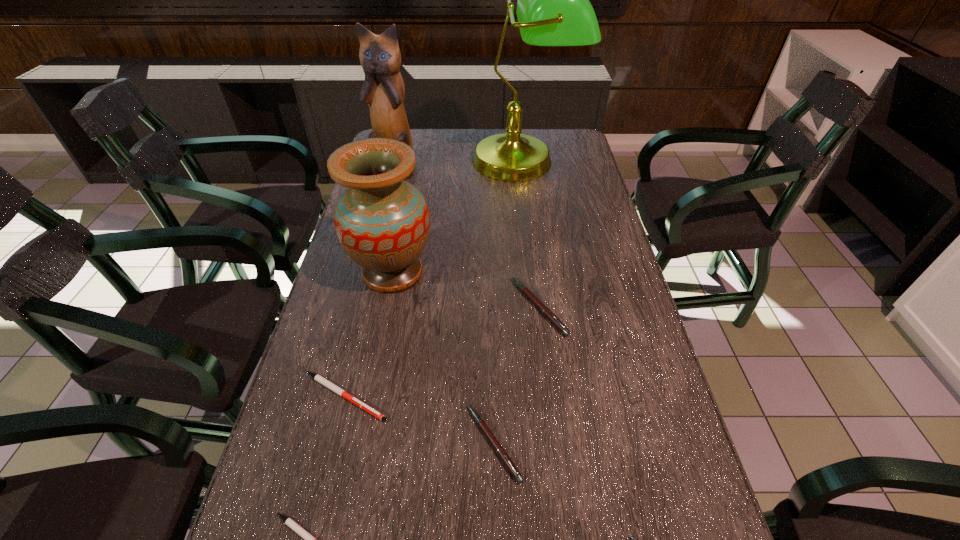
The height and width of the screenshot is (540, 960). I want to click on lamp, so click(553, 9).

The image size is (960, 540). In order to click on the tallest object in this screenshot , I will do `click(553, 9)`.

What are the coordinates of `the seventh shortest object` in the screenshot? It's located at (383, 91).

Identify the location of the sixth shortest object. This screenshot has height=540, width=960. (382, 222).

Where is `the biggest pink pen`? This screenshot has height=540, width=960. the biggest pink pen is located at coordinates (546, 311).

Identify the location of the tallest pen. (546, 311).

I want to click on the leftmost pink pen, so click(x=501, y=452).

Locate an element on the screen. This screenshot has width=960, height=540. the third pen from right to left is located at coordinates (501, 452).

This screenshot has height=540, width=960. Identify the location of the bigger white pen. (317, 377).

Where is `free space located on the desk next to the green lamp`? This screenshot has height=540, width=960. free space located on the desk next to the green lamp is located at coordinates (531, 230).